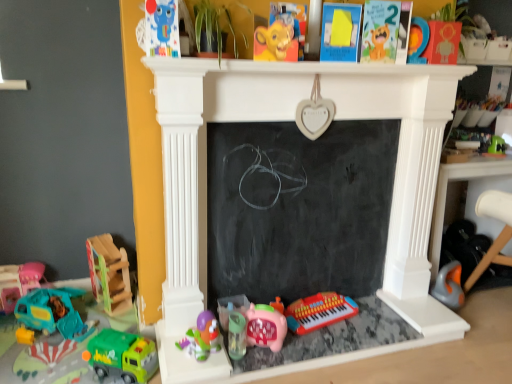
In order to click on free space in front of wooden rocking horse at left, the third toy from the left in this screenshot , I will do `click(96, 322)`.